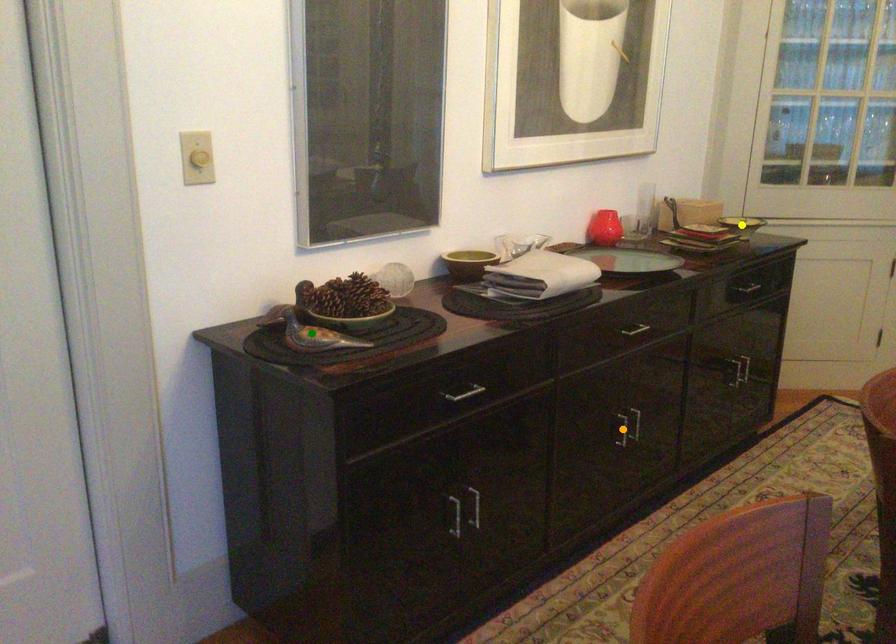
Order these from nearest to farthest:
green point
orange point
yellow point

green point, orange point, yellow point